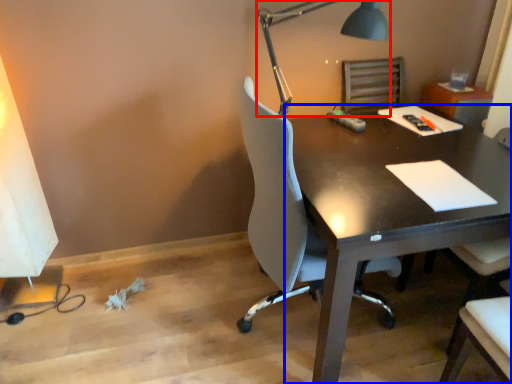
Question: Which of the following is the closest to the observer, lamp (highlighted by a red box) or desk (highlighted by a blue box)?

Choices:
 (A) lamp
 (B) desk

Answer: (B)